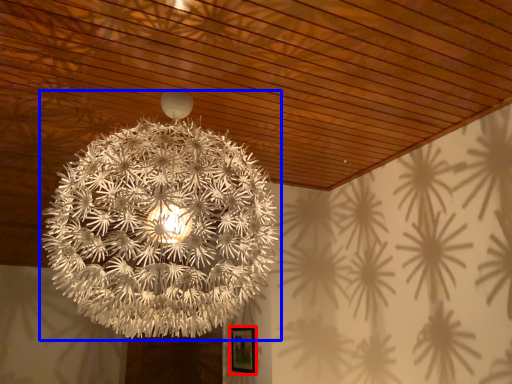
Question: Which object appears closest to the camera in this image, picture frame (highlighted by a red box) or lamp (highlighted by a blue box)?

Choices:
 (A) picture frame
 (B) lamp

Answer: (B)